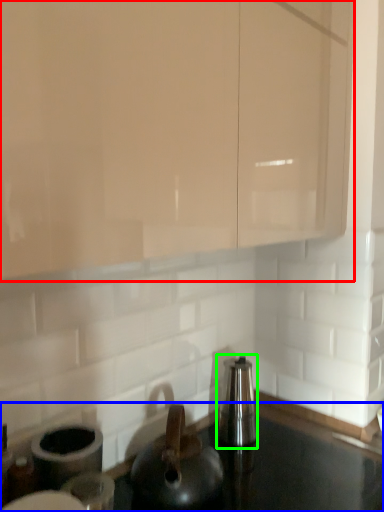
Question: Which object is the closest to the cabinetry (highlighted by a red box)? Choose among these: countertop (highlighted by a blue box) or appliance (highlighted by a green box).

Choices:
 (A) countertop
 (B) appliance

Answer: (B)